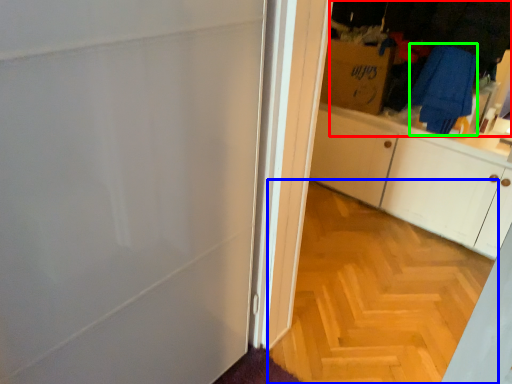
Question: Estimate the real-world distances between objects in this image. Which object is farther from laundry (highlighted by a red box), plain (highlighted by a blue box) or laundry (highlighted by a green box)?

Choices:
 (A) plain
 (B) laundry

Answer: (A)